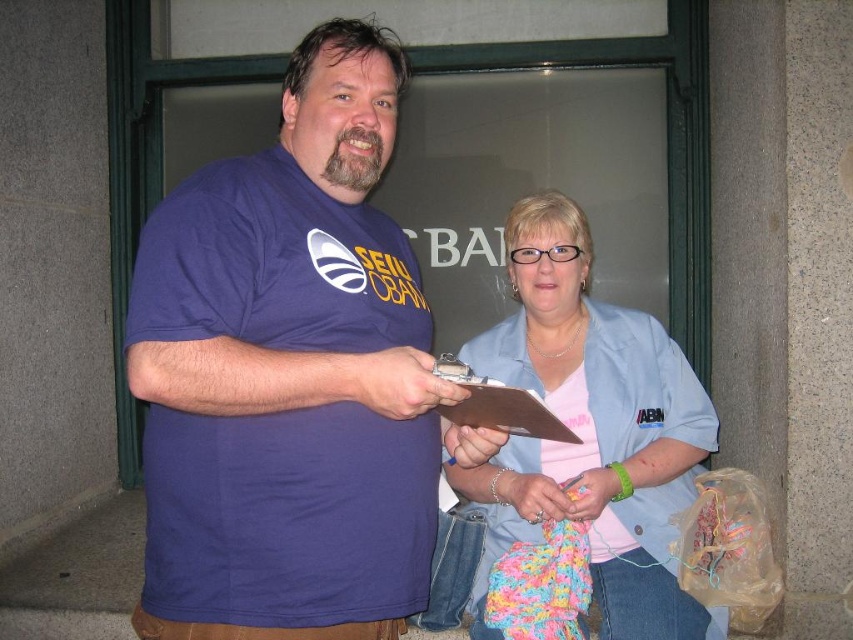
Question: Can you confirm if light blue fabric at center is positioned to the left of brown cardboard clipboard at center?

Choices:
 (A) yes
 (B) no

Answer: (B)

Question: Can you confirm if purple cotton t-shirt at center is positioned below brown cardboard clipboard at center?

Choices:
 (A) no
 (B) yes

Answer: (A)

Question: Can you confirm if purple cotton t-shirt at center is positioned to the right of brown cardboard clipboard at center?

Choices:
 (A) yes
 (B) no

Answer: (B)

Question: Considering the real-world distances, which object is closest to the light blue fabric at center?

Choices:
 (A) brown cardboard clipboard at center
 (B) purple cotton t-shirt at center

Answer: (A)

Question: Which object appears farthest from the camera in this image?

Choices:
 (A) brown cardboard clipboard at center
 (B) light blue fabric at center
 (C) purple cotton t-shirt at center

Answer: (B)

Question: Estimate the real-world distances between objects in this image. Which object is farther from the purple cotton t-shirt at center?

Choices:
 (A) brown cardboard clipboard at center
 (B) light blue fabric at center

Answer: (B)